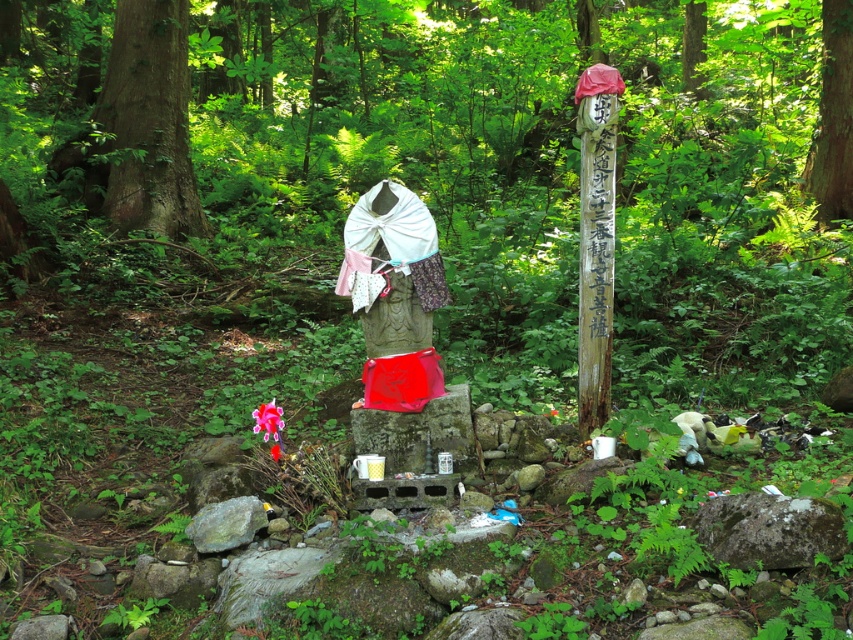
You are standing at the center of the forest scene and see the point marked at coordinates (149, 120). What object is located at that point?

The point at coordinates (149, 120) marks the location of the green rough bark tree at left.

You are a hiker trying to take a photo of both the green rough bark tree at left and the wooden carved totem pole at center right. Which object should you focus on first to ensure both are in frame?

You should focus on the wooden carved totem pole at center right first because it is farther away than the green rough bark tree at left, so adjusting the camera to capture it ensures both are in frame.

You are a hiker who wants to take a photo of the shrine in the center. To get the best shot, you need to position yourself so that the green rough bark tree at left and the smooth brown tree trunk at center are both visible in the frame. Which tree should you stand closer to in order to include both in your photo?

You should stand closer to the smooth brown tree trunk at center because it is smaller than the green rough bark tree at left, allowing you to frame both within the camera view more easily.